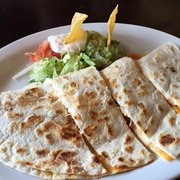
The height and width of the screenshot is (180, 180). Find the location of `plate`. plate is located at coordinates (14, 54).